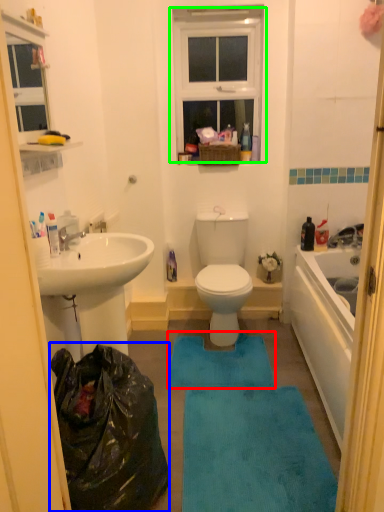
Question: Which object is the farthest from bath mat (highlighted by a red box)? Choose among these: garbage (highlighted by a blue box) or window (highlighted by a green box).

Choices:
 (A) garbage
 (B) window

Answer: (B)